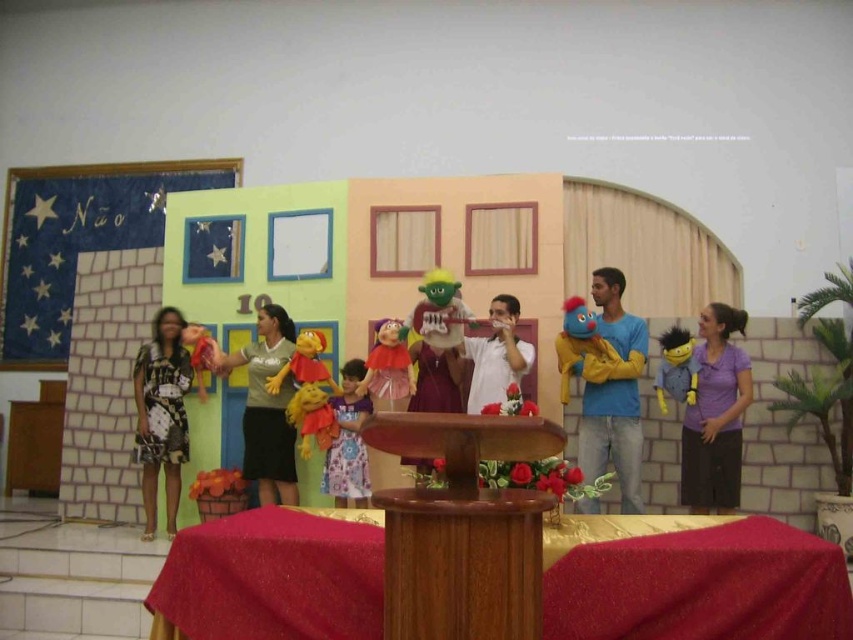
You are sitting in the audience watching the puppet show and notice two points on the stage. The first point is at position point (161, 420) and the second is at point (322, 422). Which point is closer to you?

Point (161, 420) is closer to you because it is further to the camera than point (322, 422).

Looking at this image, you are standing in the audience of the puppet show and want to know where the brown polished wood podium at center is located. Based on the coordinate system where the bottom left corner of the image is the origin, can you determine its position?

The brown polished wood podium at center is located at the coordinate point of (462, 529).